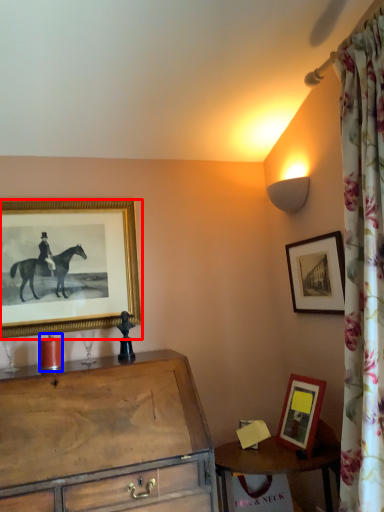
Question: Which point is further to the camera, picture frame (highlighted by a red box) or candle holder (highlighted by a blue box)?

Choices:
 (A) picture frame
 (B) candle holder

Answer: (A)